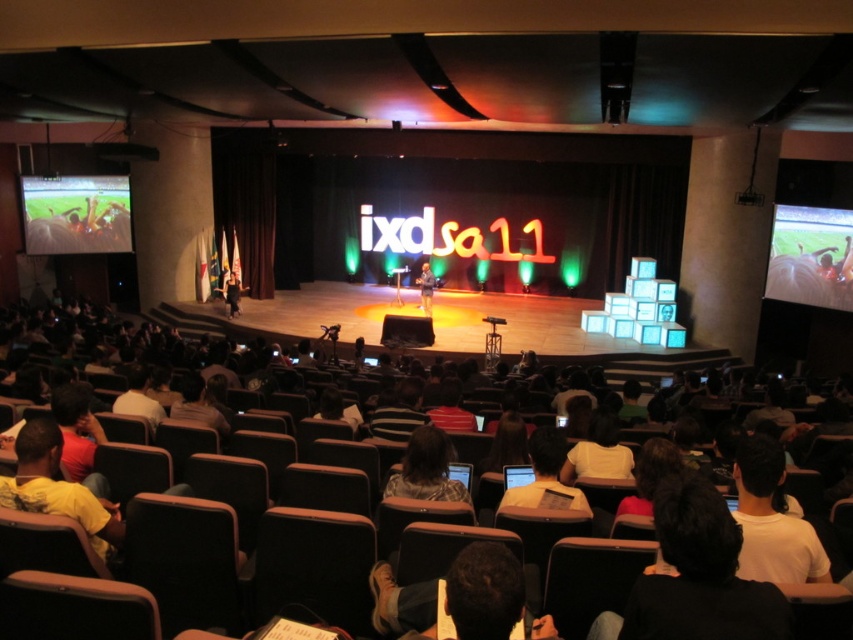
Question: Estimate the real-world distances between objects in this image. Which object is farther from the plaid shirt at center?

Choices:
 (A) white plastic laptop at center
 (B) dark blue jeans at center
 (C) dark blue shirt at center stage

Answer: (B)

Question: Which point is farther to the camera?

Choices:
 (A) white plastic laptop at center
 (B) dark blue jeans at center
 (C) plaid shirt at center
 (D) yellow t-shirt at lower left

Answer: (B)

Question: Which object is farther from the camera taking this photo?

Choices:
 (A) yellow t-shirt at lower left
 (B) dark blue jeans at center
 (C) plaid shirt at center
 (D) dark blue shirt at center stage

Answer: (B)

Question: Is yellow t-shirt at lower left further to the viewer compared to white plastic laptop at center?

Choices:
 (A) yes
 (B) no

Answer: (B)

Question: Considering the relative positions of white plastic laptop at center and dark blue jeans at center in the image provided, where is white plastic laptop at center located with respect to dark blue jeans at center?

Choices:
 (A) below
 (B) above

Answer: (A)

Question: Can you confirm if plaid shirt at center is positioned to the left of white plastic laptop at center?

Choices:
 (A) no
 (B) yes

Answer: (B)